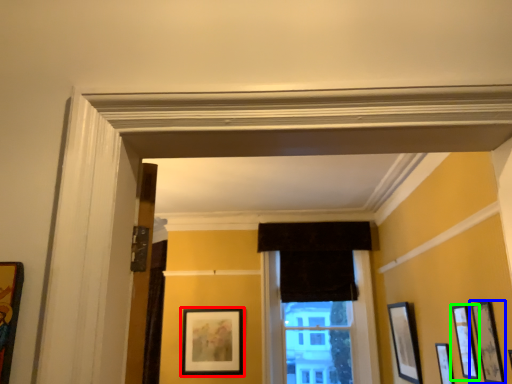
Question: Which object is the closest to the picture frame (highlighted by a red box)? Choose among these: picture frame (highlighted by a blue box) or picture frame (highlighted by a green box).

Choices:
 (A) picture frame
 (B) picture frame

Answer: (B)